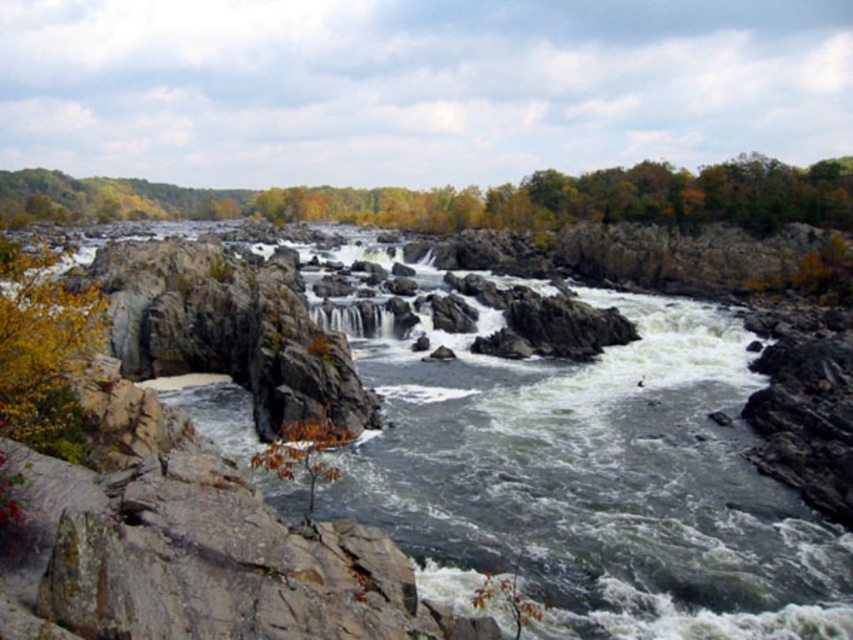
Locate an element on the screen. The height and width of the screenshot is (640, 853). green leafy tree at upper center is located at coordinates (473, 198).

Who is taller, green leafy tree at upper center or white textured water at center?

green leafy tree at upper center is taller.

Does point (758, 220) come closer to viewer compared to point (349, 324)?

No.

Where is `green leafy tree at upper center`? Image resolution: width=853 pixels, height=640 pixels. green leafy tree at upper center is located at coordinates (473, 198).

Is orange leafy tree at lower center closer to the viewer compared to white textured water at center?

Yes.

Does point (352, 436) lie behind point (347, 307)?

No.

At what (x,y) coordinates should I click in order to perform the action: click on orange leafy tree at lower center. Please return your answer as a coordinate pair (x, y). Image resolution: width=853 pixels, height=640 pixels. Looking at the image, I should click on (303, 452).

The image size is (853, 640). I want to click on green leafy tree at upper center, so click(x=473, y=198).

Is green leafy tree at upper center above orange leafy tree at lower center?

Correct, green leafy tree at upper center is located above orange leafy tree at lower center.

Measure the distance between point (x=3, y=172) and camera.

The distance of point (x=3, y=172) from camera is 991.55 feet.

You are a GUI agent. You are given a task and a screenshot of the screen. Output one action in this format:
    pyautogui.click(x=<x>, y=<y>)
    Task: Click on the green leafy tree at upper center
    This screenshot has height=640, width=853.
    Given the screenshot: What is the action you would take?
    pyautogui.click(x=473, y=198)